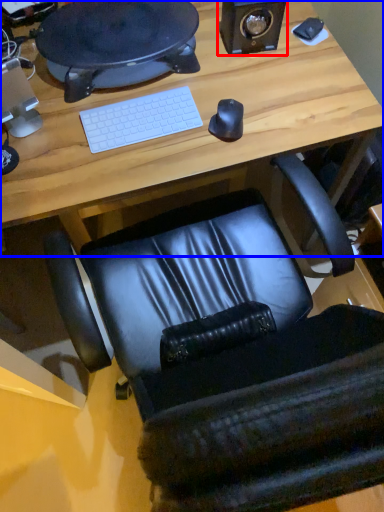
Question: Which of the following is the closest to the observer, speaker (highlighted by a red box) or desk (highlighted by a blue box)?

Choices:
 (A) speaker
 (B) desk

Answer: (B)